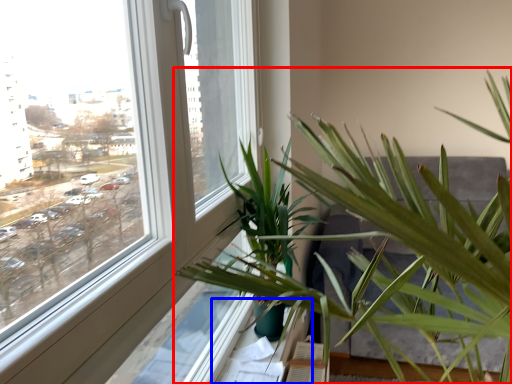
Question: Which of the following is the farthest to the observer, houseplant (highlighted by a red box) or window sill (highlighted by a blue box)?

Choices:
 (A) houseplant
 (B) window sill

Answer: (B)